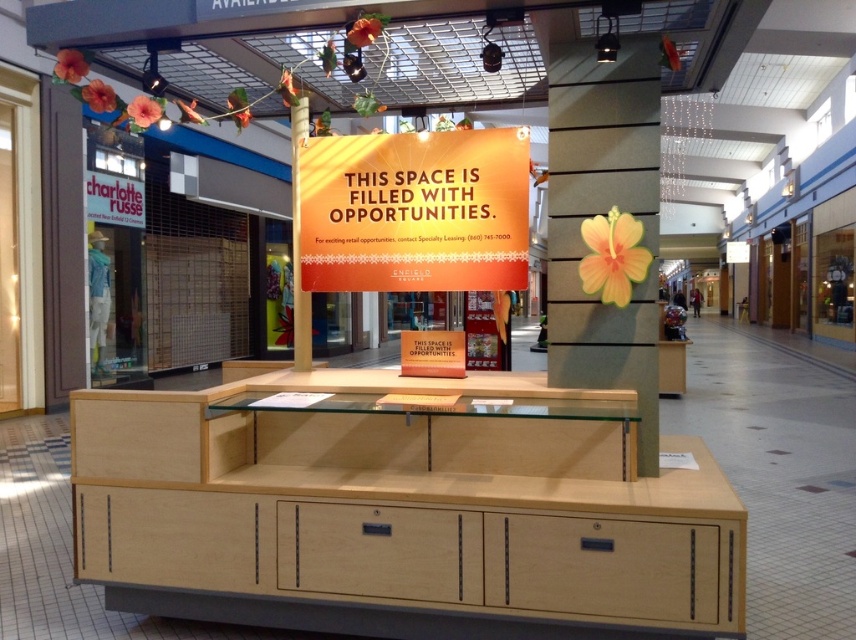
Question: Does matte gray pillar at center have a larger size compared to wooden drawer at lower right?

Choices:
 (A) no
 (B) yes

Answer: (B)

Question: Which object is positioned closest to the orange matte sign at center?

Choices:
 (A) matte gray pillar at center
 (B) light wood drawer at center

Answer: (A)

Question: Based on their relative distances, which object is nearer to the orange matte sign at center?

Choices:
 (A) matte gray pillar at center
 (B) light wood drawer at center
 (C) wooden drawer at lower right

Answer: (A)

Question: Which of the following is the farthest from the observer?

Choices:
 (A) light wood drawer at center
 (B) wooden drawer at lower right

Answer: (A)

Question: Can you confirm if orange matte sign at center is positioned above matte gray pillar at center?

Choices:
 (A) no
 (B) yes

Answer: (B)

Question: Does orange matte sign at center lie in front of wooden drawer at lower right?

Choices:
 (A) yes
 (B) no

Answer: (B)